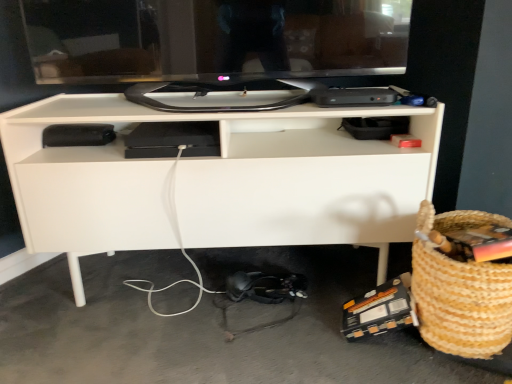
Where is `vacant space in front of white matte desk at center`? This screenshot has width=512, height=384. vacant space in front of white matte desk at center is located at coordinates (224, 345).